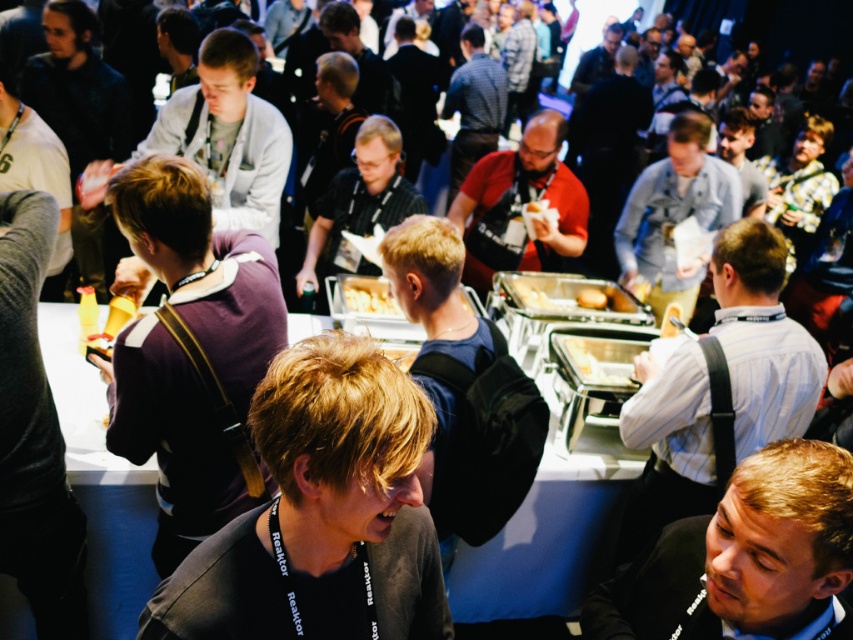
Which is more to the right, purple soft sweater at center or yellow matte bread at center?

Positioned to the right is yellow matte bread at center.

Between purple soft sweater at center and yellow matte bread at center, which one appears on the left side from the viewer's perspective?

Positioned to the left is purple soft sweater at center.

Is point (219, 349) behind point (366, 292)?

No, it is not.

Find the location of a particular element. This screenshot has height=640, width=853. purple soft sweater at center is located at coordinates (190, 353).

Does light gray jacket at upper left appear on the left side of blue shirt at center?

Yes, light gray jacket at upper left is to the left of blue shirt at center.

This screenshot has height=640, width=853. What do you see at coordinates (228, 134) in the screenshot?
I see `light gray jacket at upper left` at bounding box center [228, 134].

Locate an element on the screen. light gray jacket at upper left is located at coordinates 228,134.

Does white shirt at center have a smaller size compared to golden brown bread at center?

Incorrect, white shirt at center is not smaller in size than golden brown bread at center.

Between white shirt at center and golden brown bread at center, which one is positioned lower?

white shirt at center

Does point (631, 401) lie behind point (602, 294)?

No.

Where is `white shirt at center`? This screenshot has height=640, width=853. white shirt at center is located at coordinates (761, 339).